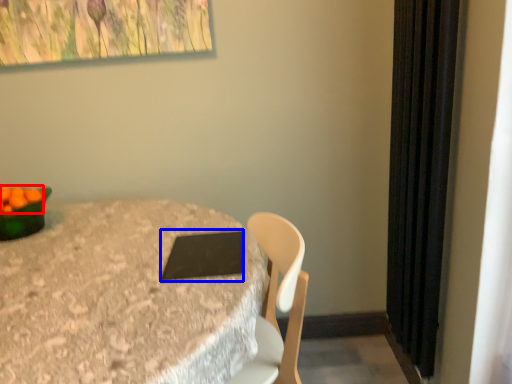
Question: Which object appears closest to the camera in this image, fruit (highlighted by a red box) or pad (highlighted by a blue box)?

Choices:
 (A) fruit
 (B) pad

Answer: (B)